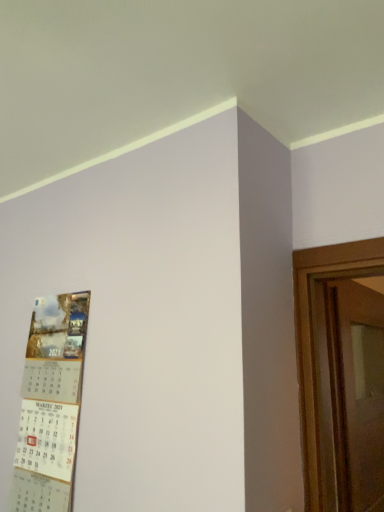
Question: From a real-world perspective, relative to wooden door at right, is matte paper calendar at left vertically above or below?

Choices:
 (A) above
 (B) below

Answer: (A)

Question: From the image's perspective, is matte paper calendar at left above or below wooden door at right?

Choices:
 (A) below
 (B) above

Answer: (B)

Question: In terms of size, does matte paper calendar at left appear bigger or smaller than wooden door at right?

Choices:
 (A) small
 (B) big

Answer: (A)

Question: From the image's perspective, relative to matte paper calendar at left, is wooden door at right above or below?

Choices:
 (A) below
 (B) above

Answer: (A)

Question: Is wooden door at right taller or shorter than matte paper calendar at left?

Choices:
 (A) short
 (B) tall

Answer: (B)

Question: Relative to matte paper calendar at left, is wooden door at right in front or behind?

Choices:
 (A) behind
 (B) front

Answer: (A)

Question: Which is correct: wooden door at right is inside matte paper calendar at left, or outside of it?

Choices:
 (A) inside
 (B) outside

Answer: (B)